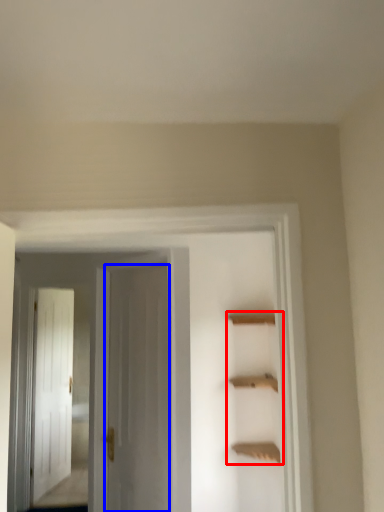
Question: Which object appears farthest to the camera in this image, cabinet (highlighted by a red box) or door (highlighted by a blue box)?

Choices:
 (A) cabinet
 (B) door

Answer: (B)